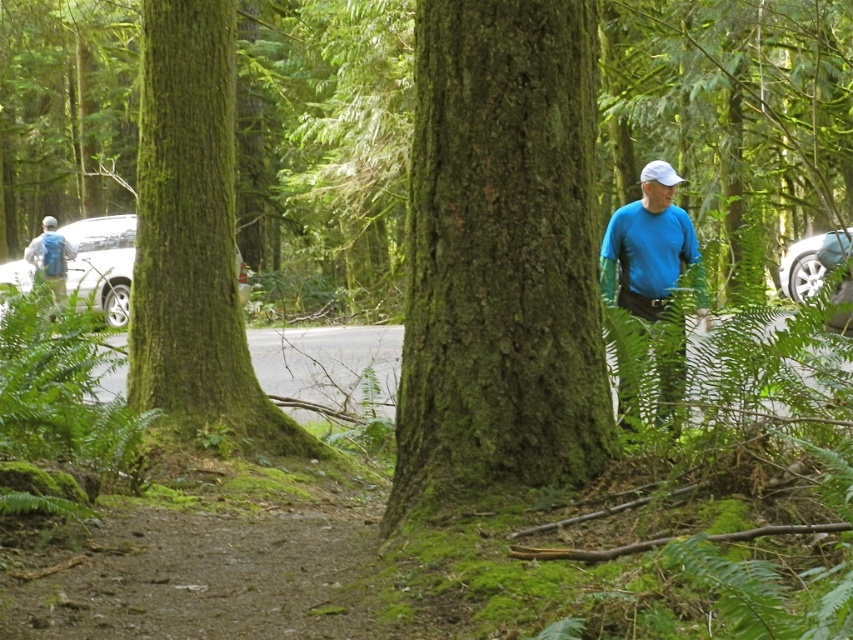
In the scene shown: Does blue matte shirt at right lie behind matte gray backpack at left?

No, blue matte shirt at right is in front of matte gray backpack at left.

Is point (663, 234) less distant than point (55, 237)?

That is True.

Does point (630, 260) come behind point (62, 237)?

That is False.

Where is `blue matte shirt at right`? This screenshot has width=853, height=640. blue matte shirt at right is located at coordinates (650, 250).

Which is in front, point (532, 72) or point (102, 241)?

Positioned in front is point (532, 72).

Is point (483, 305) behind point (126, 291)?

No.

This screenshot has width=853, height=640. Identify the location of green rough bark tree at center. (500, 257).

Does green rough bark tree at center appear over metallic silver car at right?

Incorrect, green rough bark tree at center is not positioned above metallic silver car at right.

Locate an element on the screen. The height and width of the screenshot is (640, 853). green rough bark tree at center is located at coordinates (500, 257).

Measure the distance between green rough bark tree at center and camera.

green rough bark tree at center is 5.05 meters from camera.

The width and height of the screenshot is (853, 640). Identify the location of green rough bark tree at center. (500, 257).